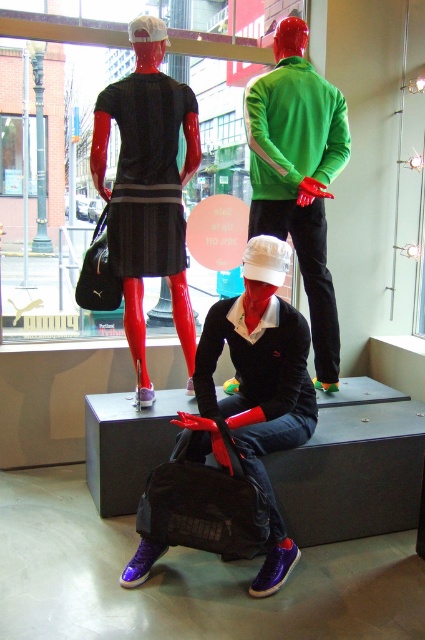
Question: Observing the image, what is the correct spatial positioning of matte black dress at left in reference to matte green jacket at upper center?

Choices:
 (A) left
 (B) right

Answer: (A)

Question: Which point appears closest to the camera in this image?

Choices:
 (A) (286, 305)
 (B) (116, 42)
 (C) (333, 378)

Answer: (A)

Question: Which of the following is the farthest from the observer?

Choices:
 (A) (266, 348)
 (B) (147, 260)
 (C) (30, 136)

Answer: (C)

Question: Can you confirm if matte black dress at upper left is positioned to the left of matte black duffel bag at center?

Choices:
 (A) no
 (B) yes

Answer: (B)

Question: Is matte black duffel bag at center positioned at the back of matte black dress at center?

Choices:
 (A) no
 (B) yes

Answer: (A)

Question: Among these points, which one is nearest to the camera?

Choices:
 (A) (11, 140)
 (B) (257, 582)

Answer: (B)